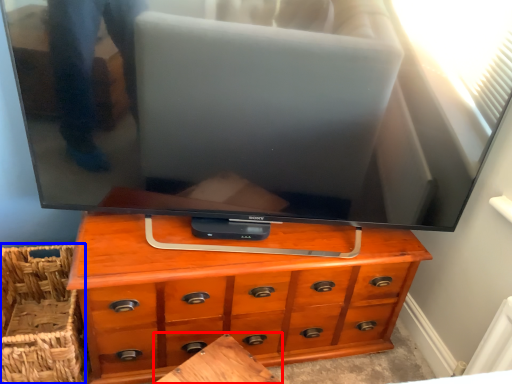
Question: Which of the following is the farthest to the observer, table (highlighted by a red box) or basket (highlighted by a blue box)?

Choices:
 (A) table
 (B) basket

Answer: (B)